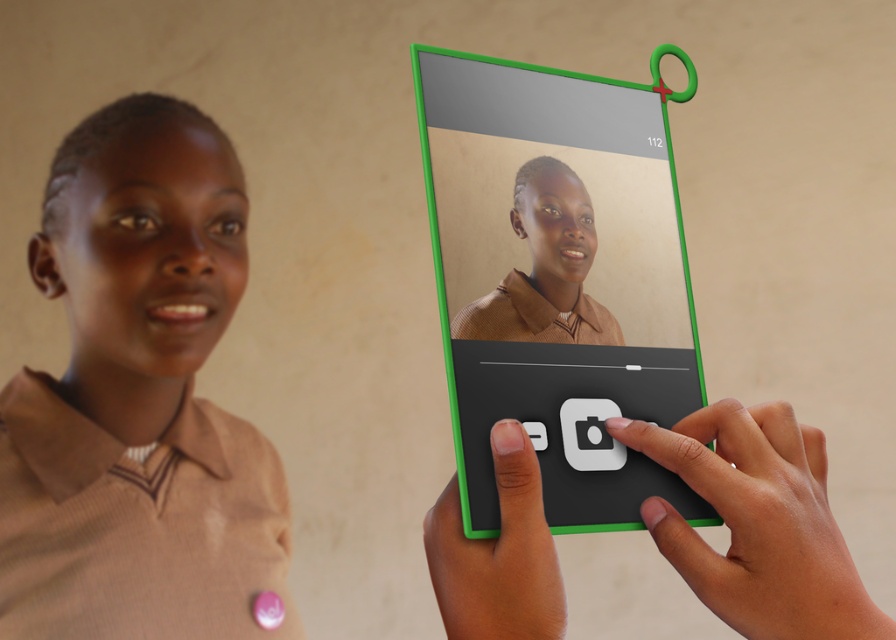
Question: Does green plastic tablet at center appear over matte black touchpad at center?

Choices:
 (A) yes
 (B) no

Answer: (A)

Question: Is matte brown sweater at center above matte black touchpad at center?

Choices:
 (A) no
 (B) yes

Answer: (B)

Question: Which of these objects is positioned closest to the black matte phone at center?

Choices:
 (A) green plastic tablet at center
 (B) matte black touchpad at center
 (C) matte brown sweater at center

Answer: (B)

Question: Is matte brown sweater at center wider than black matte phone at center?

Choices:
 (A) yes
 (B) no

Answer: (A)

Question: Which object is the closest to the green plastic tablet at center?

Choices:
 (A) black matte phone at center
 (B) matte brown sweater at center
 (C) matte black touchpad at center

Answer: (C)

Question: Which point is closer to the camera taking this photo?

Choices:
 (A) (679, 387)
 (B) (815, 602)

Answer: (B)